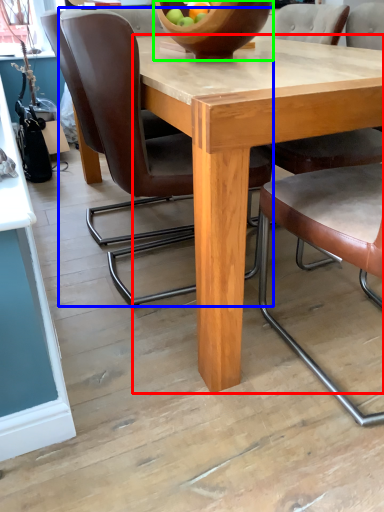
Question: Which object is positioned farthest from round table (highlighted by a red box)? Select from chair (highlighted by a blue box) and bowl (highlighted by a green box).

Choices:
 (A) chair
 (B) bowl

Answer: (A)